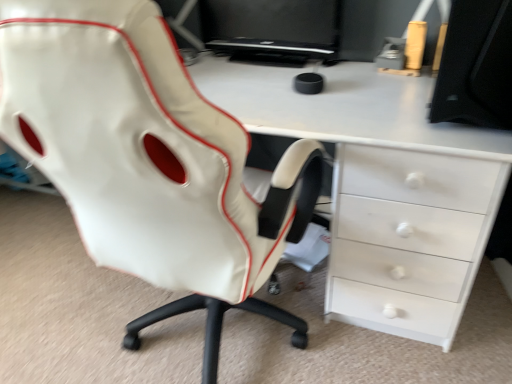
I want to click on vacant space behind black matte monitor at upper right, so 389,77.